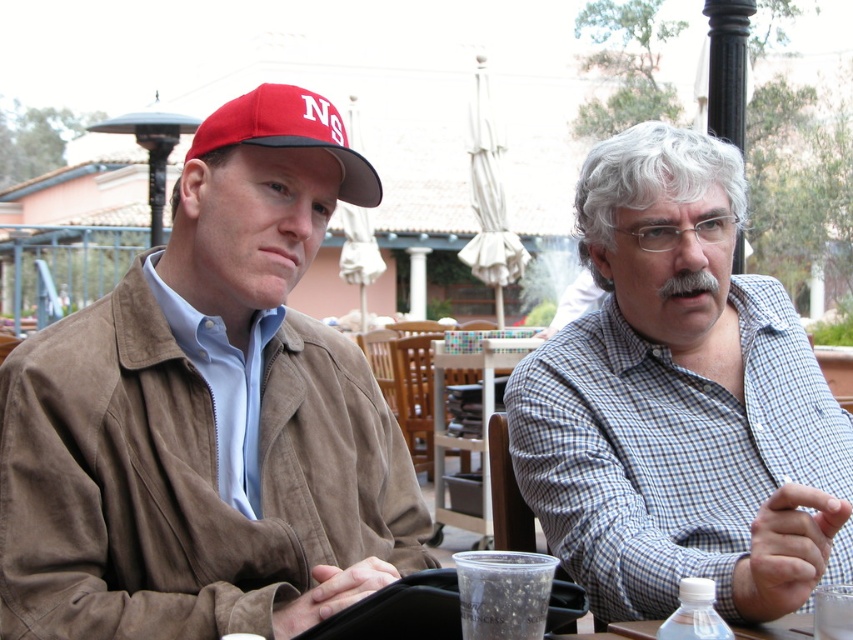
You are standing in front of the two people at the outdoor table. Which of the two points, point (653, 436) or point (212, 136), is closer to you?

Point (653, 436) is closer to you because it is further to the viewer than point (212, 136).

You are a photographer trying to capture a candid shot of the two people at the outdoor table. Since the suede jacket at left and the blue checkered shirt at right are visible in your frame, can you tell which one is positioned higher in the image?

The suede jacket at left is above the blue checkered shirt at right in the image.